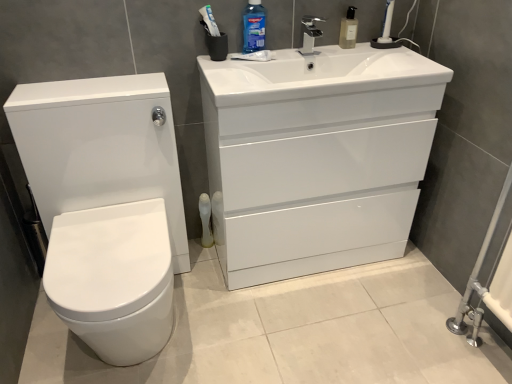
Question: Which direction should I rotate to look at translucent plastic soap dispenser at upper center, positioned as the 2th cleaning product in left-to-right order, — up or down?

Choices:
 (A) up
 (B) down

Answer: (A)

Question: From the image's perspective, would you say satin nickel faucet at upper center is positioned over white glossy toilet at left?

Choices:
 (A) no
 (B) yes

Answer: (B)

Question: Can you confirm if satin nickel faucet at upper center is wider than white glossy toilet at left?

Choices:
 (A) no
 (B) yes

Answer: (A)

Question: From a real-world perspective, is satin nickel faucet at upper center located higher than white glossy toilet at left?

Choices:
 (A) yes
 (B) no

Answer: (A)

Question: Is satin nickel faucet at upper center in front of white glossy toilet at left?

Choices:
 (A) yes
 (B) no

Answer: (B)

Question: Could you tell me if satin nickel faucet at upper center is turned towards white glossy toilet at left?

Choices:
 (A) no
 (B) yes

Answer: (A)

Question: From the image's perspective, is satin nickel faucet at upper center under white glossy toilet at left?

Choices:
 (A) no
 (B) yes

Answer: (A)

Question: From the image's perspective, is white plastic toilet brush at lower center above white glossy cabinet at upper right?

Choices:
 (A) no
 (B) yes

Answer: (A)

Question: Can you confirm if white plastic toilet brush at lower center is wider than white glossy cabinet at upper right?

Choices:
 (A) no
 (B) yes

Answer: (A)

Question: From a real-world perspective, is white plastic toilet brush at lower center physically below white glossy cabinet at upper right?

Choices:
 (A) no
 (B) yes

Answer: (B)

Question: Is white plastic toilet brush at lower center located outside white glossy cabinet at upper right?

Choices:
 (A) yes
 (B) no

Answer: (A)

Question: Would you say white plastic toilet brush at lower center is a long distance from white glossy cabinet at upper right?

Choices:
 (A) no
 (B) yes

Answer: (A)

Question: Is white glossy cabinet at upper right inside white plastic toilet brush at lower center?

Choices:
 (A) yes
 (B) no

Answer: (B)

Question: Would you say blue glossy mouthwash at upper center, the first cleaning product in the left-to-right sequence, contains white glossy toilet at left?

Choices:
 (A) yes
 (B) no

Answer: (B)